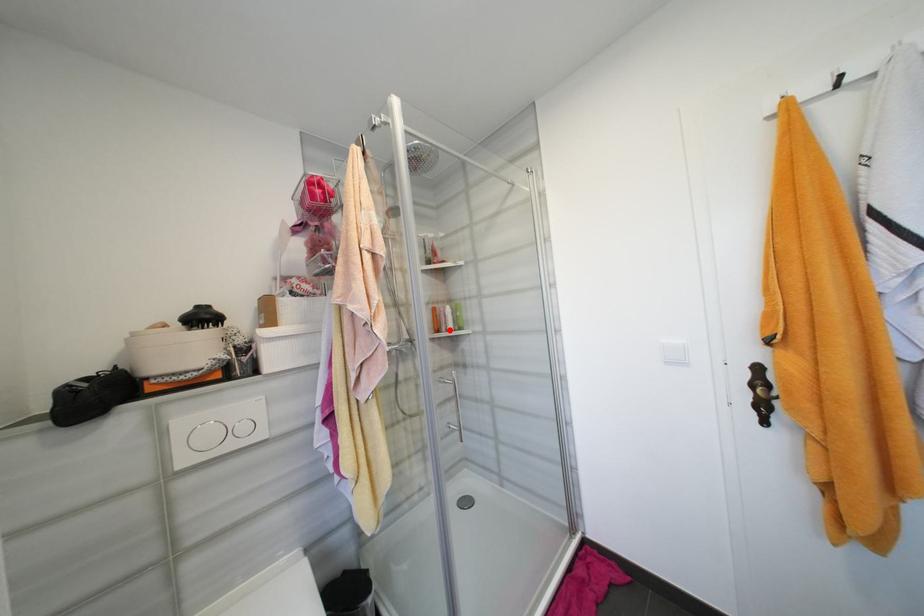
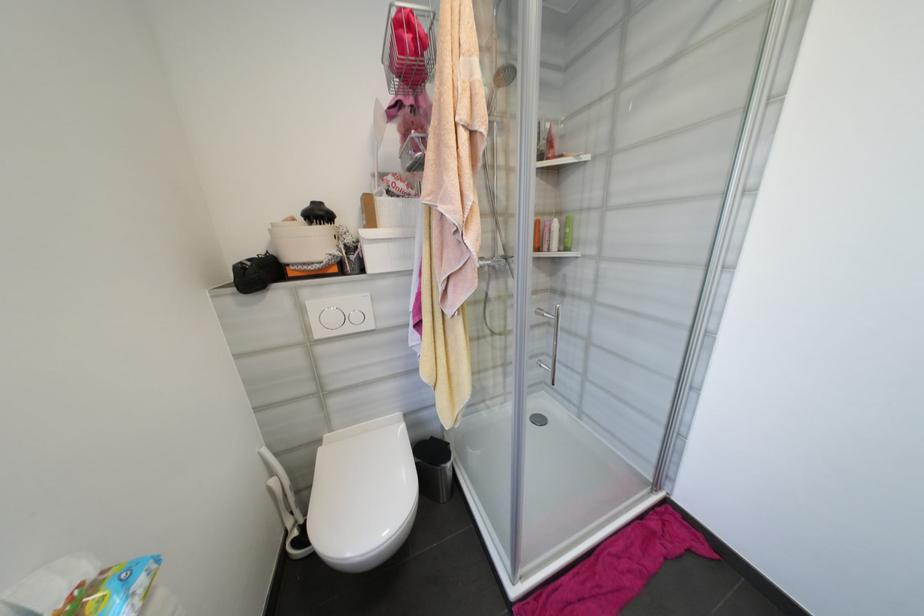
The point at the highlighted location is marked in the first image. Where is the corresponding point in the second image?

(551, 249)